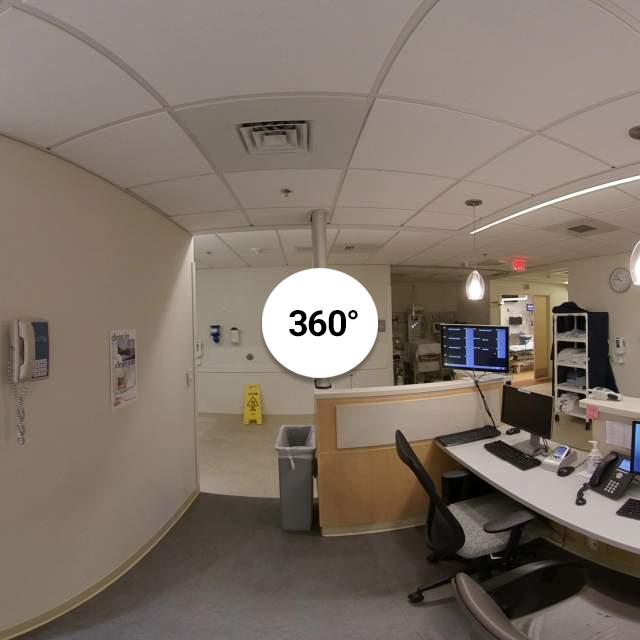
I want to click on led light, so click(x=588, y=189), click(x=544, y=205), click(x=498, y=220).